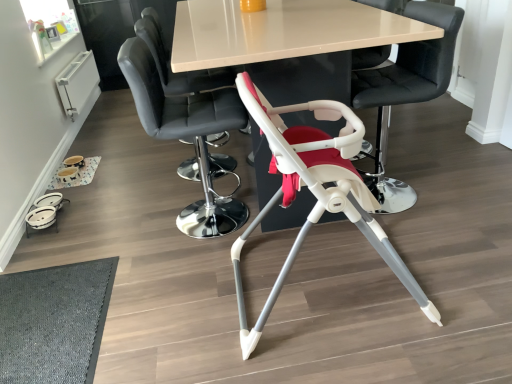
At what (x,y) coordinates should I click in order to perform the action: click on free area in between white plastic highchair at center, placed as the second chair when sorted from right to left, and white glossy table at center. Please return your answer as a coordinate pair (x, y). The image size is (512, 384). Looking at the image, I should click on (352, 269).